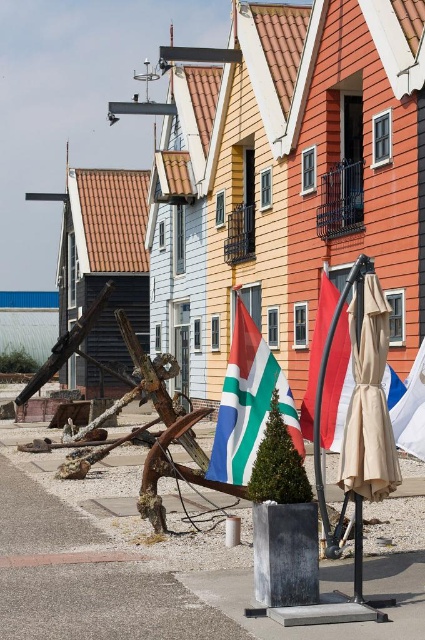
You are a tourist standing in the street scene and want to take a photo that includes both the beige fabric umbrella at center and the red fabric flag at center. Which object should you position closer to the camera to ensure both are fully visible in the frame?

Since the beige fabric umbrella at center is bigger than the red fabric flag at center, you should position the red fabric flag at center closer to the camera to ensure both fit in the frame.

You are a street vendor setting up your stall in the vibrant Dutch street scene. You have a beige fabric umbrella at center and a red fabric flag at center. Which object is narrower?

The beige fabric umbrella at center is narrower than the red fabric flag at center.